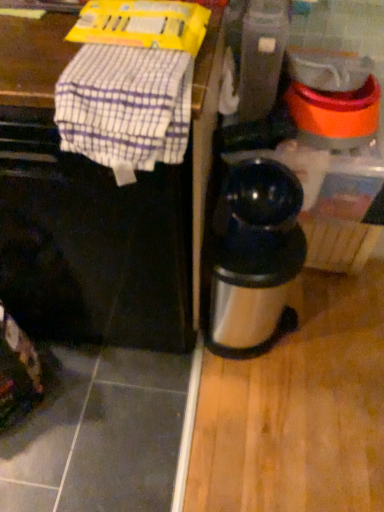
What is the approximate height of stainless steel thermos at right?

17.47 inches.

Locate an element on the screen. stainless steel thermos at right is located at coordinates (254, 257).

Which point is more forward, (268, 26) or (68, 135)?

Point (68, 135)

Is metallic gray blender at center beside white checkered cloth at upper left?

No, metallic gray blender at center is not touching white checkered cloth at upper left.

Is metallic gray blender at center in front of or behind white checkered cloth at upper left in the image?

In the image, metallic gray blender at center appears behind white checkered cloth at upper left.

How far apart are metallic gray blender at center and white checkered cloth at upper left?

A distance of 42.62 centimeters exists between metallic gray blender at center and white checkered cloth at upper left.

Based on their positions, is black matte coffee maker at center located to the left or right of white checkered cloth at upper left?

Based on their positions, black matte coffee maker at center is located to the left of white checkered cloth at upper left.

Are black matte coffee maker at center and white checkered cloth at upper left beside each other?

No, black matte coffee maker at center is not beside white checkered cloth at upper left.

Identify the location of blanket that is below the black matte coffee maker at center (from the image's perspective). The image size is (384, 512). (125, 106).

Does black matte coffee maker at center have a greater height compared to white checkered cloth at upper left?

Yes.

From the image's perspective, is stainless steel thermos at right under metallic gray blender at center?

Correct, stainless steel thermos at right appears lower than metallic gray blender at center in the image.

Between stainless steel thermos at right and metallic gray blender at center, which one has smaller size?

metallic gray blender at center is smaller.

The height and width of the screenshot is (512, 384). Find the location of `appliance to the left of stainless steel thermos at right`. appliance to the left of stainless steel thermos at right is located at coordinates (261, 57).

How far apart are stainless steel thermos at right and metallic gray blender at center?

stainless steel thermos at right and metallic gray blender at center are 14.44 inches apart from each other.

Is black matte coffee maker at center oriented away from stainless steel thermos at right?

No, black matte coffee maker at center is not facing away from stainless steel thermos at right.

In the scene shown: Considering the positions of objects black matte coffee maker at center and stainless steel thermos at right in the image provided, who is in front, black matte coffee maker at center or stainless steel thermos at right?

black matte coffee maker at center is in front.

Identify the location of vanity that is above the stainless steel thermos at right (from a real-world perspective). The height and width of the screenshot is (512, 384). (126, 224).

Is black matte coffee maker at center situated inside stainless steel thermos at right or outside?

black matte coffee maker at center lies outside stainless steel thermos at right.

Is metallic gray blender at center positioned far away from black matte coffee maker at center?

metallic gray blender at center is near black matte coffee maker at center, not far away.

Is metallic gray blender at center thinner than black matte coffee maker at center?

Yes.

Considering the relative sizes of metallic gray blender at center and black matte coffee maker at center in the image provided, is metallic gray blender at center taller than black matte coffee maker at center?

No.

Which object is positioned more to the right, stainless steel thermos at right or black matte coffee maker at center?

From the viewer's perspective, stainless steel thermos at right appears more on the right side.

Is stainless steel thermos at right not near black matte coffee maker at center?

Actually, stainless steel thermos at right and black matte coffee maker at center are a little close together.

Which is behind, point (213, 269) or point (82, 194)?

Positioned behind is point (213, 269).

Is black matte coffee maker at center at the left side of metallic gray blender at center?

Yes, black matte coffee maker at center is to the left of metallic gray blender at center.

Looking at this image, considering their positions, is black matte coffee maker at center located in front of or behind metallic gray blender at center?

In the image, black matte coffee maker at center appears in front of metallic gray blender at center.

Consider the image. Which is closer to the camera, (x=65, y=174) or (x=261, y=1)?

Point (x=65, y=174) is closer to the camera than point (x=261, y=1).

From a real-world perspective, which is physically below, black matte coffee maker at center or metallic gray blender at center?

black matte coffee maker at center.

Where is `blanket on the left of metallic gray blender at center`? Image resolution: width=384 pixels, height=512 pixels. blanket on the left of metallic gray blender at center is located at coordinates (125, 106).

Image resolution: width=384 pixels, height=512 pixels. I want to click on blanket that appears in front of the black matte coffee maker at center, so click(x=125, y=106).

When comparing their distances from white checkered cloth at upper left, does metallic gray blender at center or stainless steel thermos at right seem closer?

metallic gray blender at center is closer to white checkered cloth at upper left.

Looking at the image, which one is located further to stainless steel thermos at right, white checkered cloth at upper left or metallic gray blender at center?

The object further to stainless steel thermos at right is white checkered cloth at upper left.

Which object lies nearer to the anchor point white checkered cloth at upper left, stainless steel thermos at right or metallic gray blender at center?

The object closer to white checkered cloth at upper left is metallic gray blender at center.

Which object lies nearer to the anchor point black matte coffee maker at center, white checkered cloth at upper left or metallic gray blender at center?

The object closer to black matte coffee maker at center is white checkered cloth at upper left.

From the image, which object appears to be nearer to white checkered cloth at upper left, black matte coffee maker at center or metallic gray blender at center?

Among the two, black matte coffee maker at center is located nearer to white checkered cloth at upper left.

In the scene shown: Considering their positions, is black matte coffee maker at center positioned further to metallic gray blender at center than stainless steel thermos at right?

black matte coffee maker at center is positioned further to the anchor metallic gray blender at center.

When comparing their distances from black matte coffee maker at center, does white checkered cloth at upper left or stainless steel thermos at right seem further?

Among the two, white checkered cloth at upper left is located further to black matte coffee maker at center.

Which object lies further to the anchor point metallic gray blender at center, white checkered cloth at upper left or black matte coffee maker at center?

Among the two, white checkered cloth at upper left is located further to metallic gray blender at center.

The image size is (384, 512). I want to click on blanket between metallic gray blender at center and stainless steel thermos at right in the vertical direction, so click(125, 106).

The image size is (384, 512). What are the coordinates of `blanket between black matte coffee maker at center and stainless steel thermos at right from left to right` in the screenshot? It's located at (125, 106).

Locate an element on the screen. appliance between black matte coffee maker at center and stainless steel thermos at right in the horizontal direction is located at coordinates (261, 57).

Identify the location of blanket situated between black matte coffee maker at center and metallic gray blender at center from left to right. (125, 106).